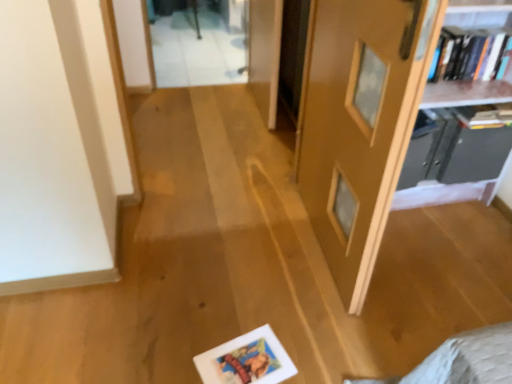
The image size is (512, 384). I want to click on free space above white matte picture frame at lower center (from a real-world perspective), so click(x=245, y=362).